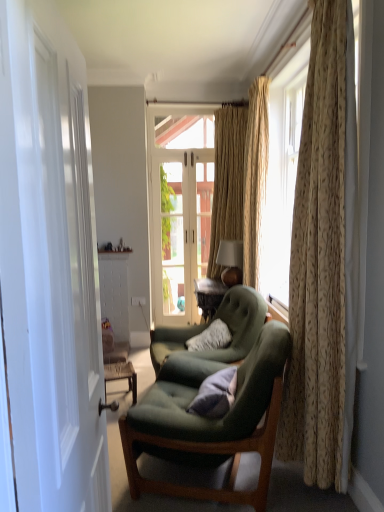
Where is `beige textured curtain at upper right, arranged as the second curtain when viewed from the back`? The image size is (384, 512). beige textured curtain at upper right, arranged as the second curtain when viewed from the back is located at coordinates (255, 178).

What do you see at coordinates (227, 181) in the screenshot? The image size is (384, 512). I see `beige textured curtain at center, the 3th curtain viewed from the front` at bounding box center [227, 181].

The height and width of the screenshot is (512, 384). Find the location of `velvet purple pillow at center`. velvet purple pillow at center is located at coordinates (215, 394).

What do you see at coordinates (138, 301) in the screenshot? The height and width of the screenshot is (512, 384). I see `white plastic power outlet at center` at bounding box center [138, 301].

Find the location of a particular element. The height and width of the screenshot is (512, 384). white plastic power outlet at center is located at coordinates (138, 301).

Locate an element on the screen. This screenshot has width=384, height=512. floral beige curtain at right, arranged as the first curtain when viewed from the front is located at coordinates (324, 260).

At what (x,y) coordinates should I click in order to perform the action: click on white glossy door at left. Please return your answer as a coordinate pair (x, y). Looking at the image, I should click on (71, 263).

Based on their positions, is white glass door at center located to the left or right of white glossy door at left?

In the image, white glass door at center appears on the right side of white glossy door at left.

From a real-world perspective, is white glass door at center physically located above or below white glossy door at left?

white glass door at center is situated lower than white glossy door at left in the real world.

Is white glass door at center facing away from white glossy door at left?

white glass door at center is not turned away from white glossy door at left.

Can you confirm if matte gold lampshade at upper right is shorter than floral beige curtain at right, the third curtain in the back-to-front sequence?

Correct, matte gold lampshade at upper right is not as tall as floral beige curtain at right, the third curtain in the back-to-front sequence.

Is matte gold lampshade at upper right situated inside floral beige curtain at right, the third curtain in the back-to-front sequence, or outside?

matte gold lampshade at upper right exists outside the volume of floral beige curtain at right, the third curtain in the back-to-front sequence.

Measure the distance from matte gold lampshade at upper right to floral beige curtain at right, arranged as the first curtain when viewed from the front.

matte gold lampshade at upper right and floral beige curtain at right, arranged as the first curtain when viewed from the front, are 1.90 meters apart.

Is matte gold lampshade at upper right touching floral beige curtain at right, the third curtain in the back-to-front sequence?

No, matte gold lampshade at upper right is not making contact with floral beige curtain at right, the third curtain in the back-to-front sequence.

Could you tell me if green fabric chair at center, positioned as the first chair in front-to-back order, is facing white glossy door at left?

No, green fabric chair at center, positioned as the first chair in front-to-back order, does not turn towards white glossy door at left.

Is point (260, 411) less distant than point (60, 432)?

No, (260, 411) is behind (60, 432).

From the image's perspective, between green fabric chair at center, positioned as the first chair in front-to-back order, and white glossy door at left, who is located below?

From the image's view, green fabric chair at center, positioned as the first chair in front-to-back order, is below.

Is there a large distance between white glossy door at left and velvet purple pillow at center?

That's not correct — white glossy door at left is a little close to velvet purple pillow at center.

Can you confirm if white glossy door at left is bigger than velvet purple pillow at center?

Correct, white glossy door at left is larger in size than velvet purple pillow at center.

Is white glossy door at left turned away from velvet purple pillow at center?

No.

Does white glossy door at left have a greater height compared to velvet purple pillow at center?

Yes.

From a real-world perspective, which object rests below the other?

floral beige curtain at right, arranged as the first curtain when viewed from the front.

Considering the relative sizes of floral beige curtain at right, the third curtain in the back-to-front sequence, and beige textured curtain at center, which ranks as the first curtain in back-to-front order, in the image provided, is floral beige curtain at right, the third curtain in the back-to-front sequence, taller than beige textured curtain at center, which ranks as the first curtain in back-to-front order,?

Indeed, floral beige curtain at right, the third curtain in the back-to-front sequence, has a greater height compared to beige textured curtain at center, which ranks as the first curtain in back-to-front order.

Which of these two, floral beige curtain at right, the third curtain in the back-to-front sequence, or beige textured curtain at center, which ranks as the first curtain in back-to-front order, is wider?

beige textured curtain at center, which ranks as the first curtain in back-to-front order, is wider.

How different are the orientations of floral beige curtain at right, the third curtain in the back-to-front sequence, and beige textured curtain at center, the 3th curtain viewed from the front, in degrees?

They differ by 88.9 degrees in their facing directions.

Is white plastic power outlet at center at the right side of green fabric couch at center?

Indeed, white plastic power outlet at center is positioned on the right side of green fabric couch at center.

Is the depth of white plastic power outlet at center greater than that of green fabric couch at center?

Yes, white plastic power outlet at center is further from the camera.

Is white plastic power outlet at center not near green fabric couch at center?

They are positioned close to each other.

How different are the orientations of white plastic power outlet at center and green fabric couch at center in degrees?

The facing directions of white plastic power outlet at center and green fabric couch at center are 76.9 degrees apart.

Which object is more forward, beige textured curtain at center, which ranks as the first curtain in back-to-front order, or matte gold lampshade at upper right?

Positioned in front is matte gold lampshade at upper right.

Who is shorter, beige textured curtain at center, which ranks as the first curtain in back-to-front order, or matte gold lampshade at upper right?

Standing shorter between the two is matte gold lampshade at upper right.

In the scene shown: Which is closer to the camera, (237, 219) or (240, 262)?

The point (240, 262) is in front.

From a real-world perspective, is beige textured curtain at center, which ranks as the first curtain in back-to-front order, over matte gold lampshade at upper right?

Yes.

This screenshot has height=512, width=384. Find the location of `screen door located in front of the white glass door at center`. screen door located in front of the white glass door at center is located at coordinates click(71, 263).

In order to click on lamp lying on the left of floral beige curtain at right, the third curtain in the back-to-front sequence in this screenshot , I will do `click(231, 262)`.

When comparing their distances from matte gold lampshade at upper right, does floral beige curtain at right, arranged as the first curtain when viewed from the front, or green fabric chair at center, positioned as the first chair in front-to-back order, seem closer?

green fabric chair at center, positioned as the first chair in front-to-back order, is positioned closer to the anchor matte gold lampshade at upper right.

Considering their positions, is beige textured curtain at center, the 3th curtain viewed from the front, positioned closer to white plastic power outlet at center than velvet purple pillow at center?

Among the two, beige textured curtain at center, the 3th curtain viewed from the front, is located nearer to white plastic power outlet at center.

When comparing their distances from velvet purple pillow at center, does matte gold lampshade at upper right or green fabric chair at center, positioned as the first chair in front-to-back order, seem further?

Based on the image, matte gold lampshade at upper right appears to be further to velvet purple pillow at center.

From the image, which object appears to be farther from white glass door at center, velvet green armchair at center, the first chair when ordered from back to front, or floral beige curtain at right, the third curtain in the back-to-front sequence?

The object further to white glass door at center is floral beige curtain at right, the third curtain in the back-to-front sequence.

Estimate the real-world distances between objects in this image. Which object is further from matte gold lampshade at upper right, white glass door at center or white plastic power outlet at center?

Among the two, white plastic power outlet at center is located further to matte gold lampshade at upper right.

When comparing their distances from white glass door at center, does beige textured curtain at center, the 3th curtain viewed from the front, or beige textured curtain at upper right, which is counted as the 2th curtain, starting from the front, seem further?

Based on the image, beige textured curtain at upper right, which is counted as the 2th curtain, starting from the front, appears to be further to white glass door at center.

Based on their spatial positions, is green fabric couch at center or matte gold lampshade at upper right closer to floral beige curtain at right, the third curtain in the back-to-front sequence?

green fabric couch at center is positioned closer to the anchor floral beige curtain at right, the third curtain in the back-to-front sequence.

Considering their positions, is beige textured curtain at upper right, which is counted as the 2th curtain, starting from the front, positioned further to white glass door at center than beige textured curtain at center, the 3th curtain viewed from the front?

The object further to white glass door at center is beige textured curtain at upper right, which is counted as the 2th curtain, starting from the front.

Where is `studio couch between white glossy door at left and beige textured curtain at center, which ranks as the first curtain in back-to-front order, from front to back`? This screenshot has height=512, width=384. studio couch between white glossy door at left and beige textured curtain at center, which ranks as the first curtain in back-to-front order, from front to back is located at coordinates (118, 364).

Where is `pillow between white glossy door at left and green fabric couch at center along the z-axis`? This screenshot has height=512, width=384. pillow between white glossy door at left and green fabric couch at center along the z-axis is located at coordinates (215, 394).

Where is `curtain positioned between white glossy door at left and beige textured curtain at upper right, which is counted as the 2th curtain, starting from the front, from near to far`? curtain positioned between white glossy door at left and beige textured curtain at upper right, which is counted as the 2th curtain, starting from the front, from near to far is located at coordinates (324, 260).

This screenshot has height=512, width=384. Identify the location of power outlet positioned between beige textured curtain at upper right, which is counted as the 2th curtain, starting from the front, and white glass door at center from near to far. (138, 301).